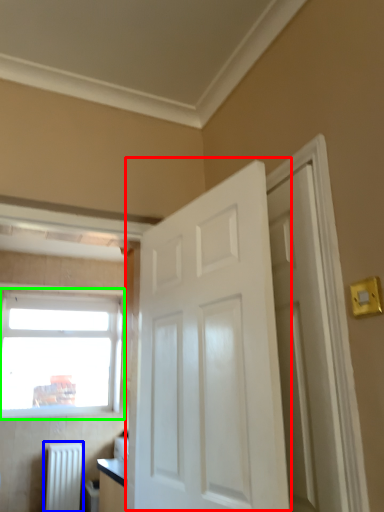
Question: Considering the real-world distances, which object is farthest from door (highlighted by a red box)? radiator (highlighted by a blue box) or window (highlighted by a green box)?

Choices:
 (A) radiator
 (B) window

Answer: (B)